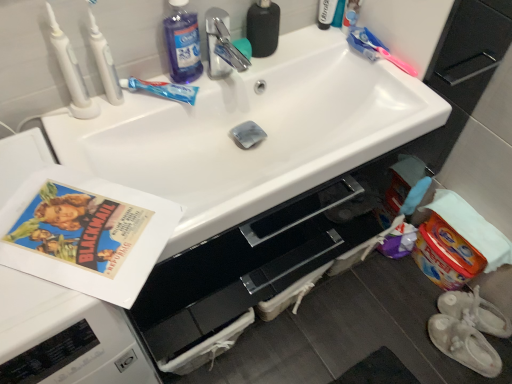
At what (x,y) coordinates should I click in order to perform the action: click on vacant location below white fabric slipper at lower right, the 1th footwear viewed from the front (from a real-world perspective). Please return your answer as a coordinate pair (x, y). The width and height of the screenshot is (512, 384). Looking at the image, I should click on (468, 355).